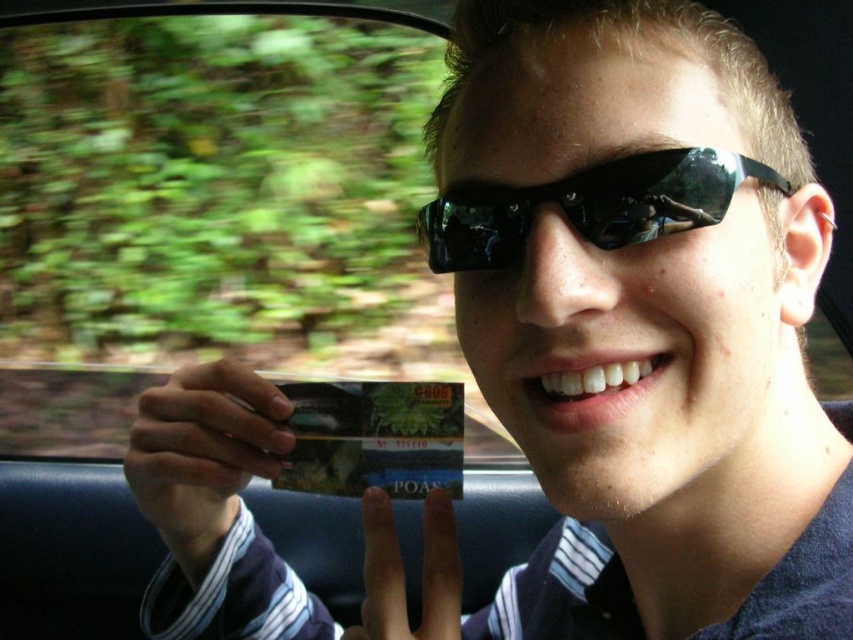
You are a passenger in a moving car and want to read the text on the metallic green credit card at center. Can you see the text clearly through the black reflective sunglasses at center?

The black reflective sunglasses at center is in front of the metallic green credit card at center, so the sunglasses would block your view of the text on the card.

You are a passenger in the vehicle and want to put your black reflective sunglasses at center into your bag. Where should you place your hand to reach them?

You should place your hand at point (589, 205) to reach the black reflective sunglasses at center.

You are inside the vehicle and want to know which point is closer to you. The points are point (x=521, y=244) and point (x=323, y=467). Which one is closer?

Point (x=521, y=244) is in front of point (x=323, y=467), so it is closer to you.